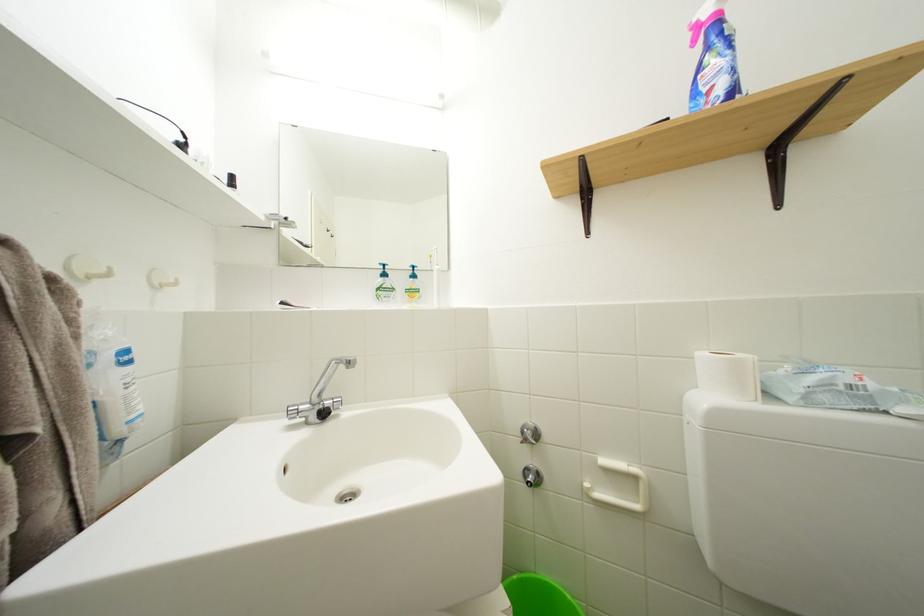
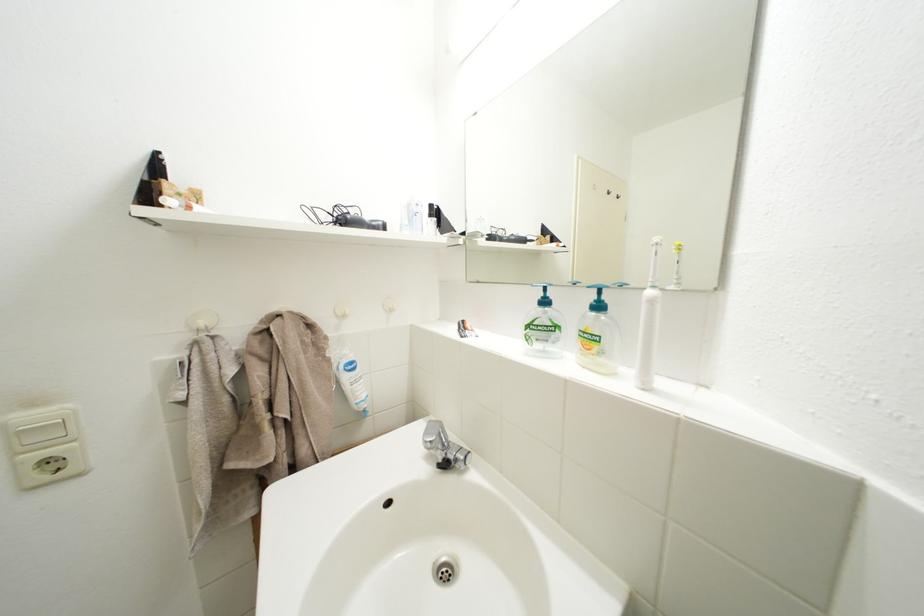
Question: The first image is from the beginning of the video and the second image is from the end. How did the camera likely rotate when shooting the video?

Choices:
 (A) Left
 (B) Right
 (C) Up
 (D) Down

Answer: (A)